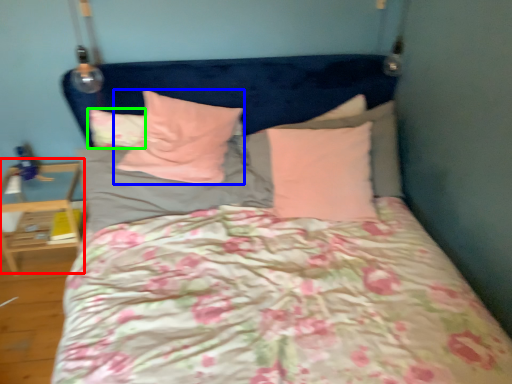
Question: Based on their relative distances, which object is farther from table (highlighted by a red box)? Choose from pillow (highlighted by a blue box) and pillow (highlighted by a green box).

Choices:
 (A) pillow
 (B) pillow

Answer: (A)